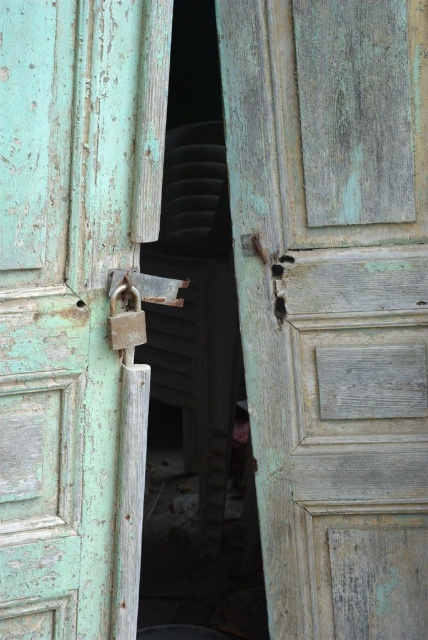
Question: Which object is farther from the camera taking this photo?

Choices:
 (A) peeling teal wood door at center
 (B) rusty metal padlock at center
 (C) metallic padlock at center
 (D) green weathered wood door at left

Answer: (A)

Question: Is peeling teal wood door at center wider than rusty metal padlock at center?

Choices:
 (A) no
 (B) yes

Answer: (B)

Question: Can you confirm if green weathered wood door at left is bigger than metallic padlock at center?

Choices:
 (A) yes
 (B) no

Answer: (A)

Question: Considering the real-world distances, which object is farthest from the peeling teal wood door at center?

Choices:
 (A) green weathered wood door at left
 (B) rusty metal padlock at center
 (C) metallic padlock at center

Answer: (B)

Question: From the image, what is the correct spatial relationship of peeling teal wood door at center in relation to green weathered wood door at left?

Choices:
 (A) right
 (B) left

Answer: (A)

Question: Among these objects, which one is farthest from the camera?

Choices:
 (A) rusty metal padlock at center
 (B) peeling teal wood door at center
 (C) metallic padlock at center

Answer: (B)